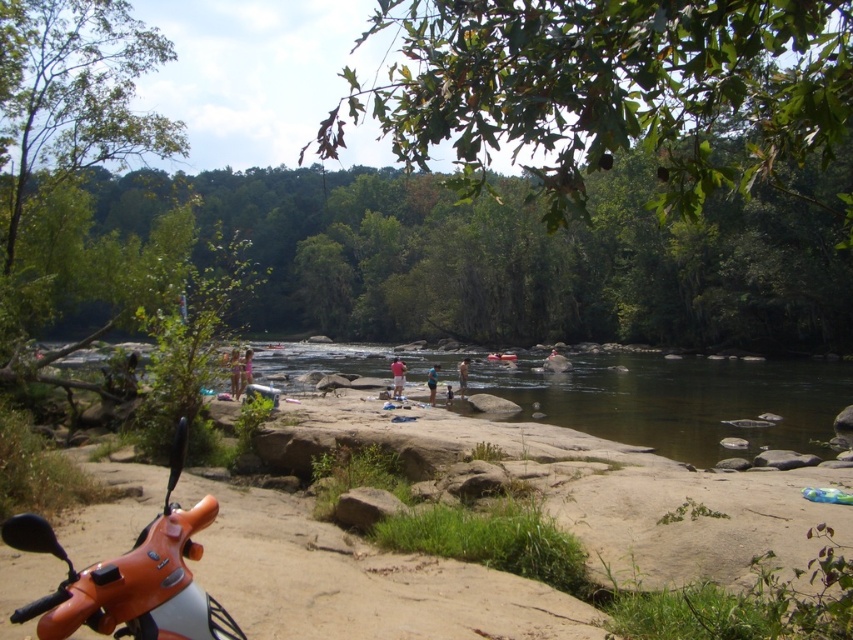
Which is in front, point (215, 627) or point (463, 362)?

Point (215, 627) is in front.

Is orange matte/metallic motorcycle at lower left to the right of tan fabric shorts at center from the viewer's perspective?

In fact, orange matte/metallic motorcycle at lower left is to the left of tan fabric shorts at center.

Identify the location of orange matte/metallic motorcycle at lower left. Image resolution: width=853 pixels, height=640 pixels. (131, 577).

I want to click on orange matte/metallic motorcycle at lower left, so click(x=131, y=577).

Is point (402, 387) closer to viewer compared to point (460, 397)?

That is True.

In the scene shown: Does tan cotton shirt at center appear under tan fabric shorts at center?

Incorrect, tan cotton shirt at center is not positioned below tan fabric shorts at center.

Is point (395, 378) positioned behind point (461, 394)?

That is False.

Identify the location of tan cotton shirt at center. (397, 376).

Which is in front, point (463, 371) or point (433, 374)?

Point (433, 374) is in front.

Find the location of a particular element. This screenshot has width=853, height=640. tan fabric shorts at center is located at coordinates (462, 376).

At what (x,y) coordinates should I click in order to perform the action: click on tan fabric shorts at center. Please return your answer as a coordinate pair (x, y). The image size is (853, 640). Looking at the image, I should click on (462, 376).